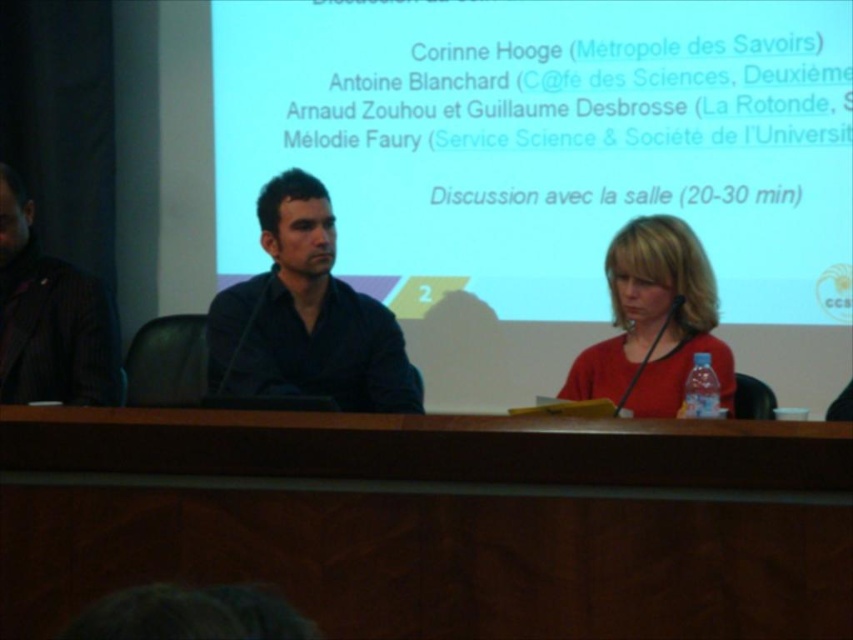
Question: Can you confirm if wooden table at center is positioned below matte red blouse at center?

Choices:
 (A) no
 (B) yes

Answer: (B)

Question: Which point is farther from the camera taking this photo?

Choices:
 (A) (22, 234)
 (B) (357, 424)
 (C) (299, 289)
 (D) (839, 259)

Answer: (D)

Question: Which of the following is the farthest from the observer?

Choices:
 (A) (688, 19)
 (B) (730, 376)
 (C) (20, 352)

Answer: (A)

Question: Is white matte projection screen at center above wooden table at center?

Choices:
 (A) yes
 (B) no

Answer: (A)

Question: Is the position of wooden table at center more distant than that of matte red blouse at center?

Choices:
 (A) no
 (B) yes

Answer: (A)

Question: Which point appears farthest from the camera in this image?

Choices:
 (A) (80, 292)
 (B) (305, 380)

Answer: (A)